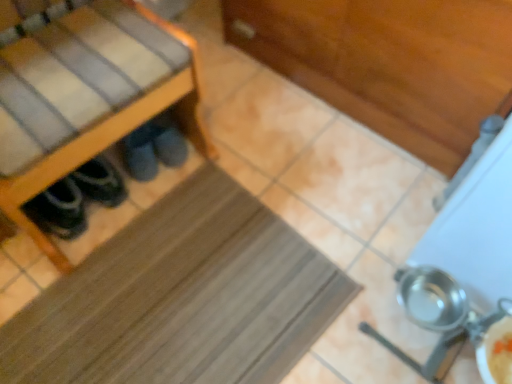
Find the location of `vacant space in front of dark gray suede slippers at lower left`. vacant space in front of dark gray suede slippers at lower left is located at coordinates (174, 198).